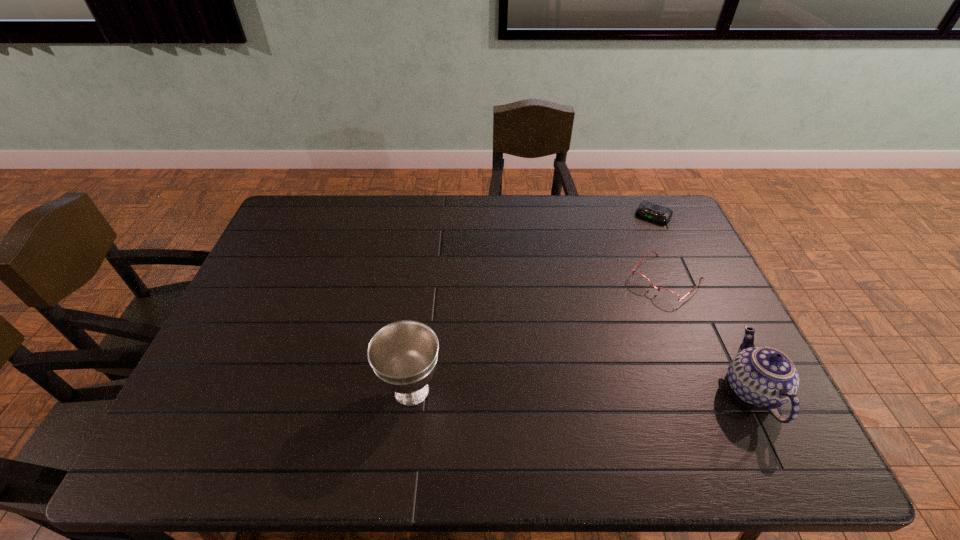
The image size is (960, 540). What are the coordinates of `object that is positioned at the far right corner` in the screenshot? It's located at (659, 214).

The image size is (960, 540). What are the coordinates of `object present at the near right corner` in the screenshot? It's located at (765, 377).

In the image, there is a desktop. Identify the location of vacant space at the far edge. (348, 196).

Image resolution: width=960 pixels, height=540 pixels. In the image, there is a desktop. Identify the location of vacant area at the near edge. (653, 396).

At what (x,y) coordinates should I click in order to perform the action: click on vacant space at the left edge of the desktop. Please return your answer as a coordinate pair (x, y). This screenshot has height=540, width=960. Looking at the image, I should click on coord(302,260).

You are a GUI agent. You are given a task and a screenshot of the screen. Output one action in this format:
    pyautogui.click(x=<x>, y=<y>)
    Task: Click on the vacant space at the right edge of the desktop
    This screenshot has height=540, width=960.
    Given the screenshot: What is the action you would take?
    pyautogui.click(x=692, y=361)

In the image, there is a desktop. Where is `vacant area at the near left corner`? This screenshot has height=540, width=960. vacant area at the near left corner is located at coordinates (211, 415).

Image resolution: width=960 pixels, height=540 pixels. In the image, there is a desktop. Find the location of `vacant space at the far right corner`. vacant space at the far right corner is located at coordinates tap(666, 226).

The image size is (960, 540). In order to click on free space between the chalice and the second farthest object in this screenshot , I will do `click(539, 335)`.

In order to click on free area in between the third nearest object and the chalice in this screenshot , I will do `click(539, 335)`.